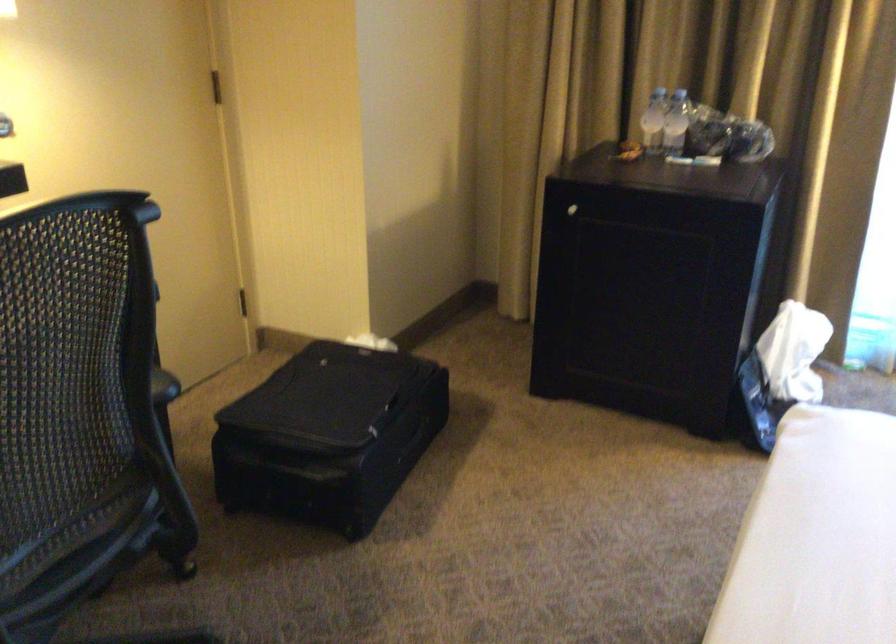
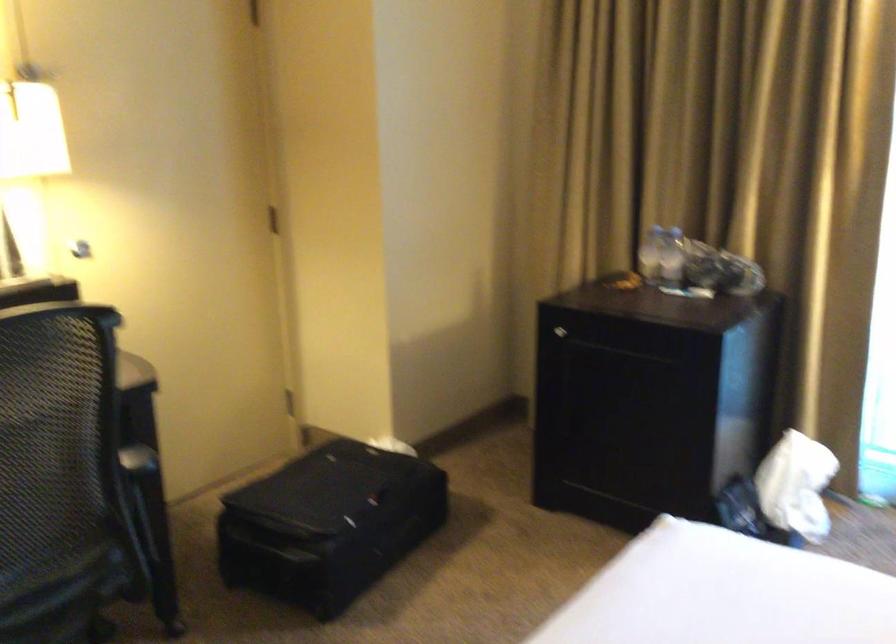
Where in the second image is the point corresponding to [148,462] from the first image?

(136, 527)